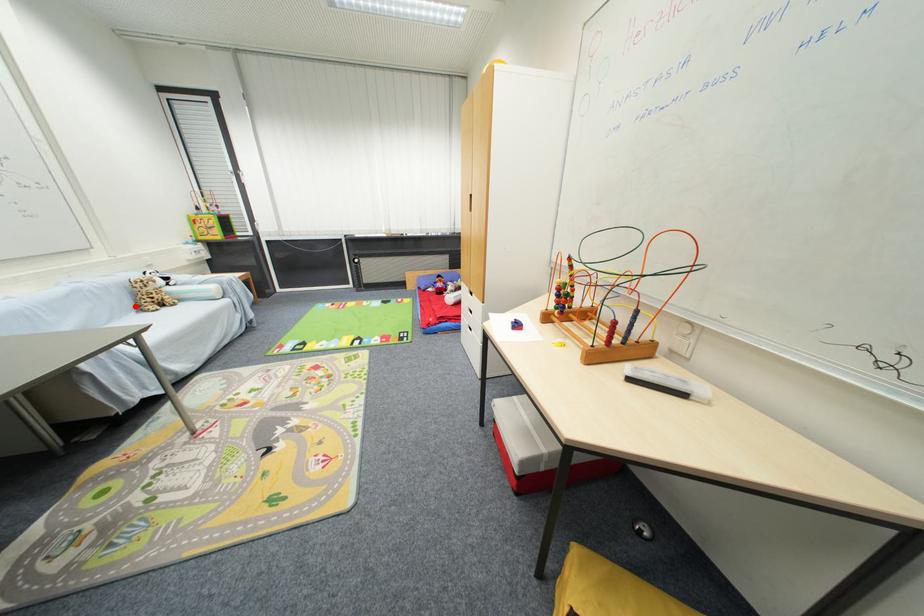
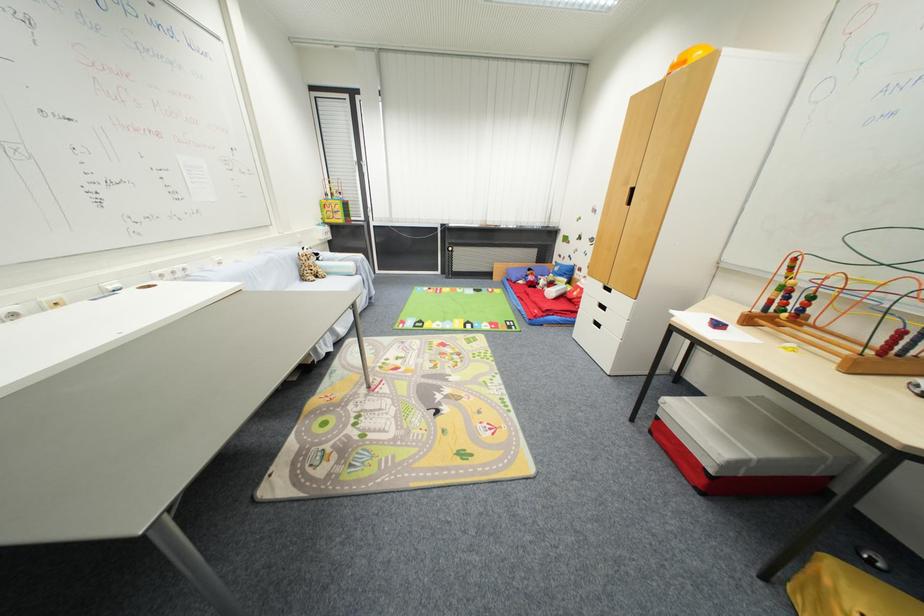
Question: I am providing you with two images of the same scene from different viewpoints. Given a red point in image1, look at the same physical point in image2. Is it:

Choices:
 (A) Closer to the viewpoint
 (B) Farther from the viewpoint

Answer: (A)